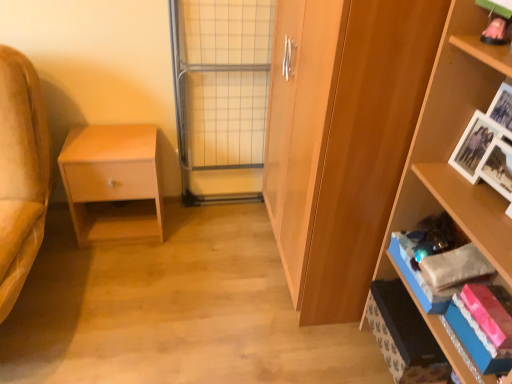
Locate an element on the screen. empty space that is ontop of matte wood nightstand at left (from a real-world perspective) is located at coordinates (111, 142).